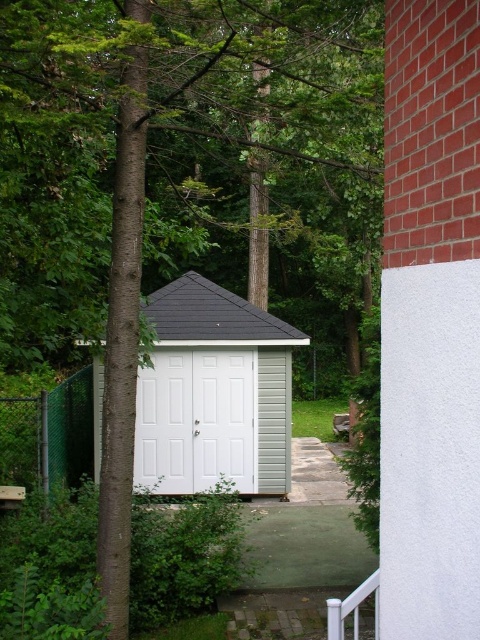
You are standing at the point with coordinates (214,390) in the backyard. What structure is located exactly at your current position?

The white siding shed at center is located exactly at the point with coordinates (214,390).

You are standing at the edge of the driveway and see the white siding shed at center and the white plastic rail at lower right. Which object is closer to the right side of the image?

The white plastic rail at lower right is closer to the right side of the image because it is positioned to the right of the white siding shed at center.

You are standing in the backyard looking at the shed and the structures around it. There are two points marked in the image. The first point is at coordinates point (151, 294) and the second is at point (345, 612). Which of these two points is closer to you?

Point (151, 294) is further to the camera than point (345, 612), so the point closer to you is point (345, 612).